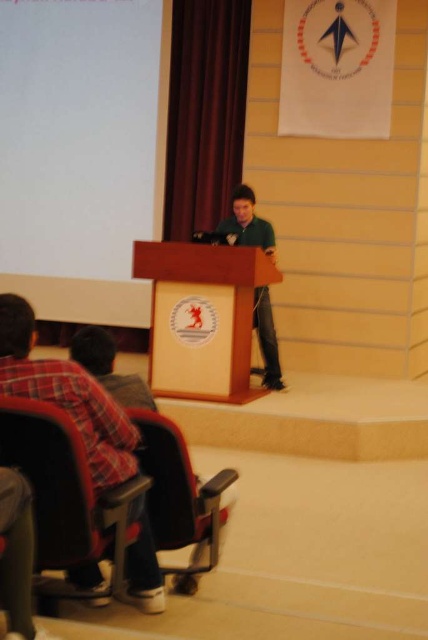
You are an attendee in the audience and want to move to the front row. The front row has seats starting from the matte black chair at lower left. Can you walk directly to the matte black chair at lower left from your current position at point (180, 497)?

The point (180, 497) corresponds to the matte black chair at lower left, so you are already at the matte black chair at lower left.

You are an attendee at the presentation and need to adjust your seating to ensure you can see the wooden podium at center clearly. Considering the height of the plush fabric chair at lower left, would sitting in that chair likely block your view of the podium?

The wooden podium at center has a greater height compared to the plush fabric chair at lower left, so sitting in the plush fabric chair at lower left would not block your view of the podium since the podium is taller.

You are an attendee at this event and want to see the speaker clearly. Is the wooden podium at center blocking your view of the green matte shirt at center?

The wooden podium at center is much taller than the green matte shirt at center, so it may block your view of the speaker wearing the green matte shirt at center.